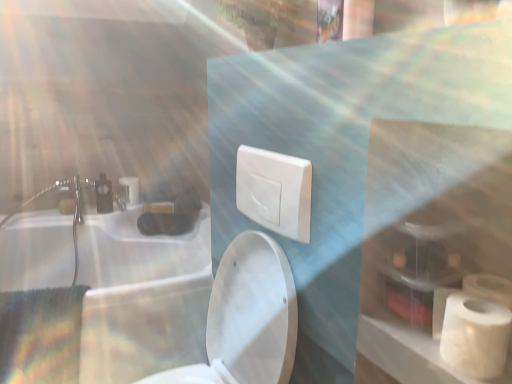
Question: Is white glossy toilet at center taller or shorter than white plastic switch at center?

Choices:
 (A) short
 (B) tall

Answer: (B)

Question: Do you think white glossy toilet at center is within white plastic switch at center, or outside of it?

Choices:
 (A) inside
 (B) outside

Answer: (B)

Question: Which object is positioned closest to the white glossy sink at upper left?

Choices:
 (A) white plastic switch at center
 (B) white matte toiletry bag at lower right
 (C) matte white faucet at upper left
 (D) white glossy toilet at center
 (E) white matte toilet paper at right, the first toilet paper ordered from the bottom

Answer: (C)

Question: Considering the real-world distances, which object is farthest from the white glossy sink at upper left?

Choices:
 (A) white matte toilet paper at lower right, arranged as the second toilet paper when ordered from the bottom
 (B) matte white faucet at upper left
 (C) white matte toilet paper at right, the first toilet paper when ordered from right to left
 (D) white glossy toilet at center
 (E) white plastic switch at center

Answer: (C)